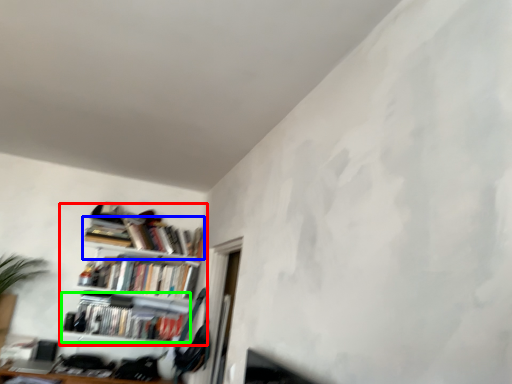
Question: Which object is positioned closest to shelf (highlighted by a red box)? Select from book (highlighted by a blue box) and book (highlighted by a green box).

Choices:
 (A) book
 (B) book

Answer: (B)